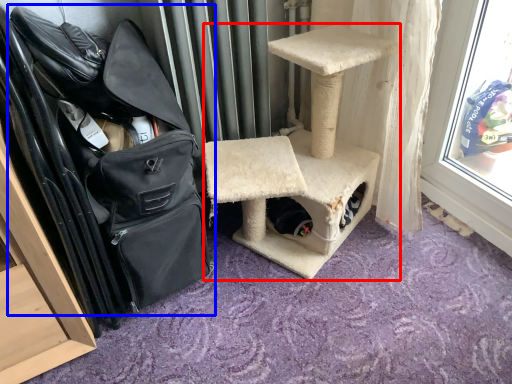
Question: Which object appears closest to the camera in this image, furniture (highlighted by a red box) or shoulder bag (highlighted by a blue box)?

Choices:
 (A) furniture
 (B) shoulder bag

Answer: (B)